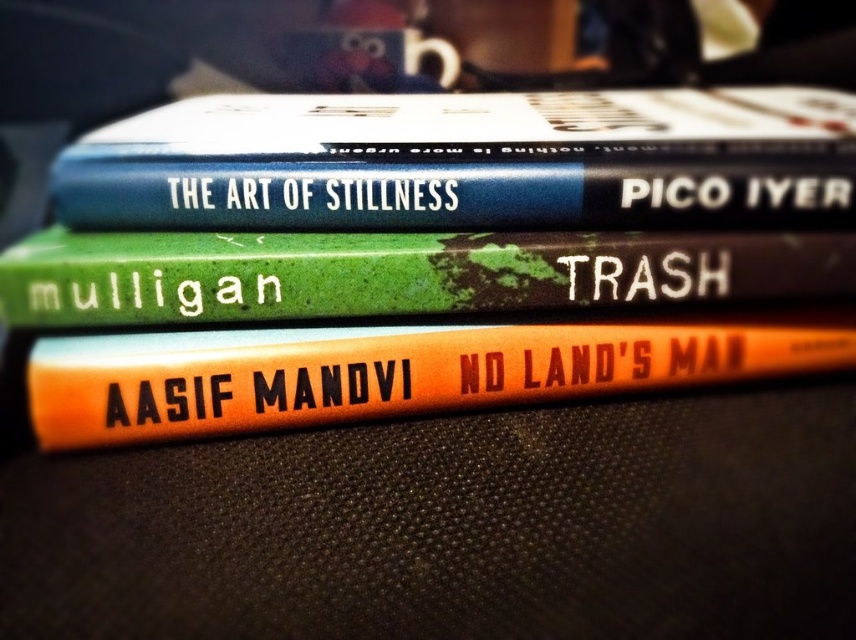
Question: Can you confirm if hardcover book at center is positioned above orange matte book at center?

Choices:
 (A) no
 (B) yes

Answer: (B)

Question: Where is orange matte book at center located in relation to green matte book at center in the image?

Choices:
 (A) right
 (B) left

Answer: (A)

Question: Which of the following is the closest to the observer?

Choices:
 (A) (568, 97)
 (B) (851, 358)
 (C) (721, 252)

Answer: (C)

Question: Based on their relative distances, which object is farther from the orange matte book at center?

Choices:
 (A) green matte book at center
 (B) hardcover book at center

Answer: (B)

Question: Estimate the real-world distances between objects in this image. Which object is farther from the green matte book at center?

Choices:
 (A) orange matte book at center
 (B) hardcover book at center

Answer: (B)

Question: Can you confirm if orange matte book at center is thinner than green matte book at center?

Choices:
 (A) yes
 (B) no

Answer: (A)